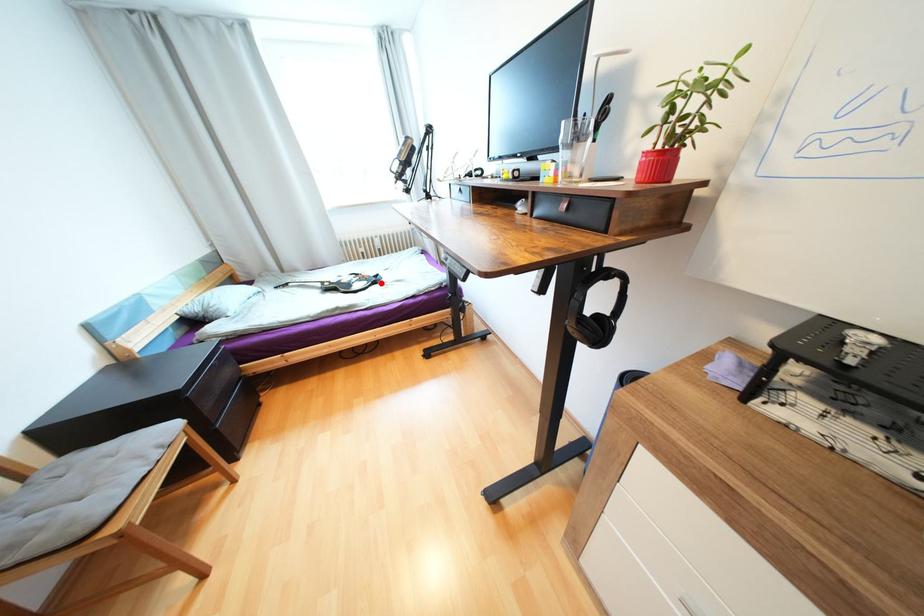
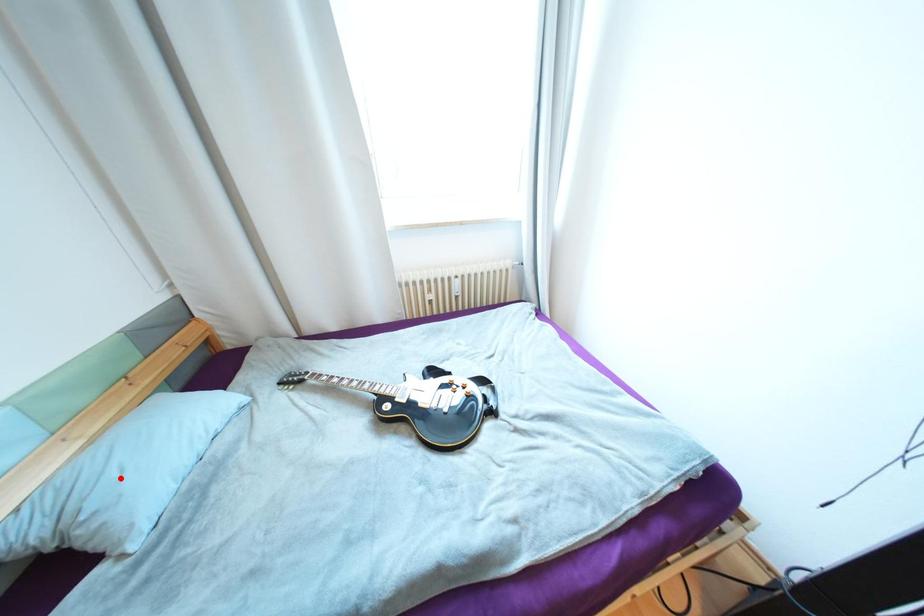
I am providing you with two images of the same scene from different viewpoints. A red point is marked on the first image and another point is marked on the second image. Is the red point in image1 aligned with the point shown in image2?

No